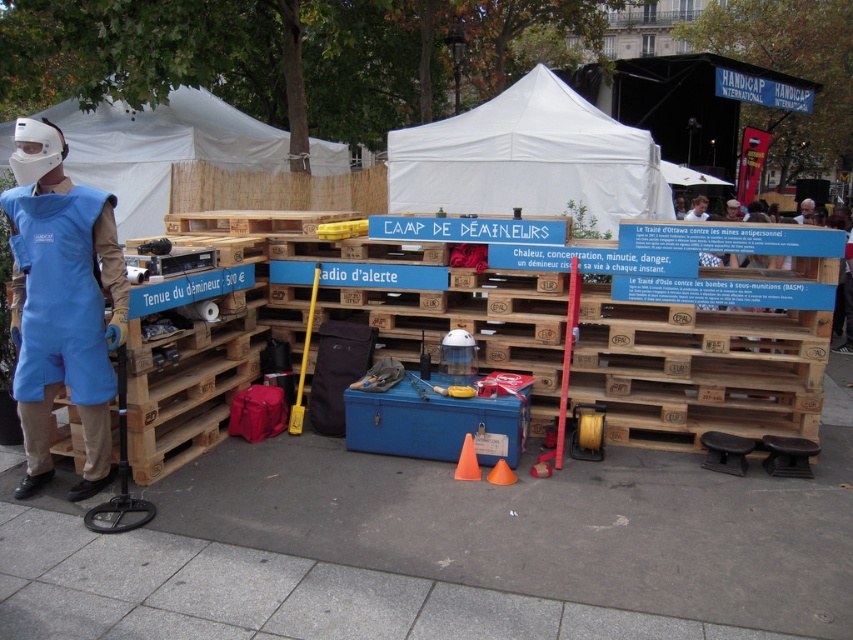
Is gray concrete pavement at lower center taller than blue fabric suit at left?

Incorrect, gray concrete pavement at lower center's height is not larger of blue fabric suit at left's.

Is gray concrete pavement at lower center above blue fabric suit at left?

Actually, gray concrete pavement at lower center is below blue fabric suit at left.

Which is in front, point (552, 525) or point (32, 332)?

Positioned in front is point (552, 525).

Locate an element on the screen. The width and height of the screenshot is (853, 640). gray concrete pavement at lower center is located at coordinates (544, 525).

Can you confirm if white fabric tent at center is taller than white fabric tent at upper center?

Indeed, white fabric tent at center has a greater height compared to white fabric tent at upper center.

Is white fabric tent at center above white fabric tent at upper center?

No.

Does point (636, 129) come behind point (264, 160)?

Yes.

This screenshot has width=853, height=640. I want to click on white fabric tent at center, so coord(527,160).

Which is behind, point (93, 337) or point (99, 182)?

Point (99, 182)

Is point (105, 435) positioned after point (178, 144)?

No, (105, 435) is closer to viewer.

Is point (32, 474) farther from viewer compared to point (322, 144)?

No, (32, 474) is in front of (322, 144).

Identify the location of blue fabric suit at left. (62, 304).